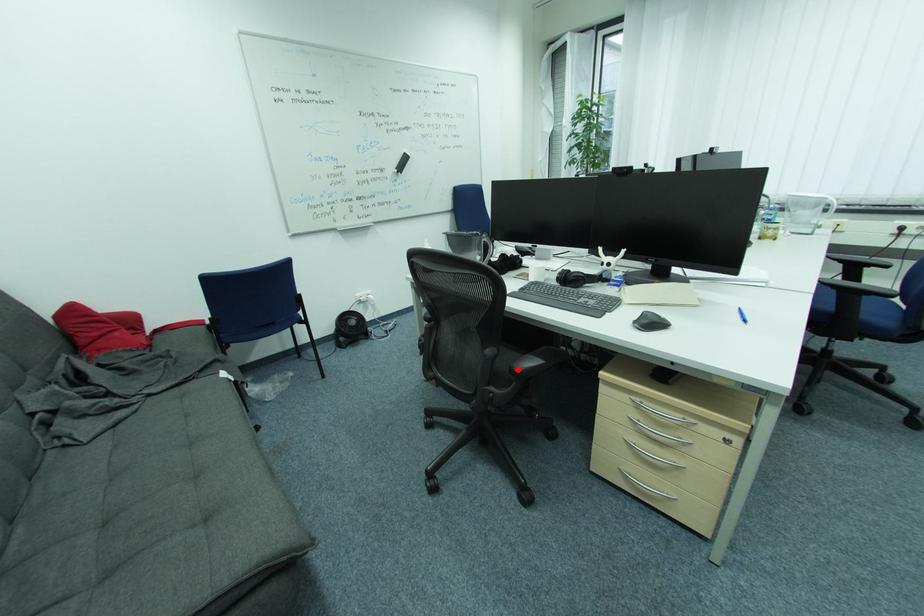
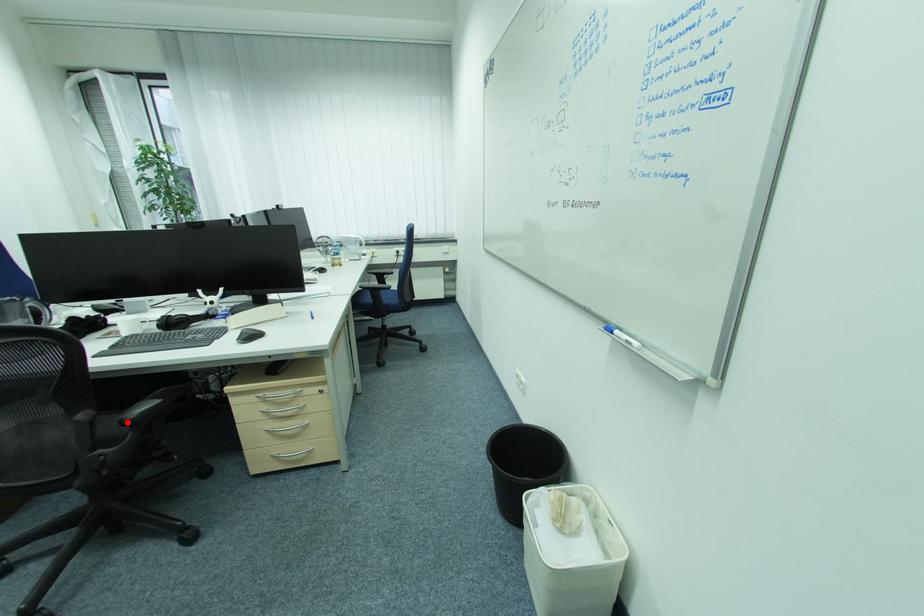
I am providing you with two images of the same scene from different viewpoints. A red point is marked on the first image and another point is marked on the second image. Does the point marked in image1 correspond to the same location as the one in image2?

Yes